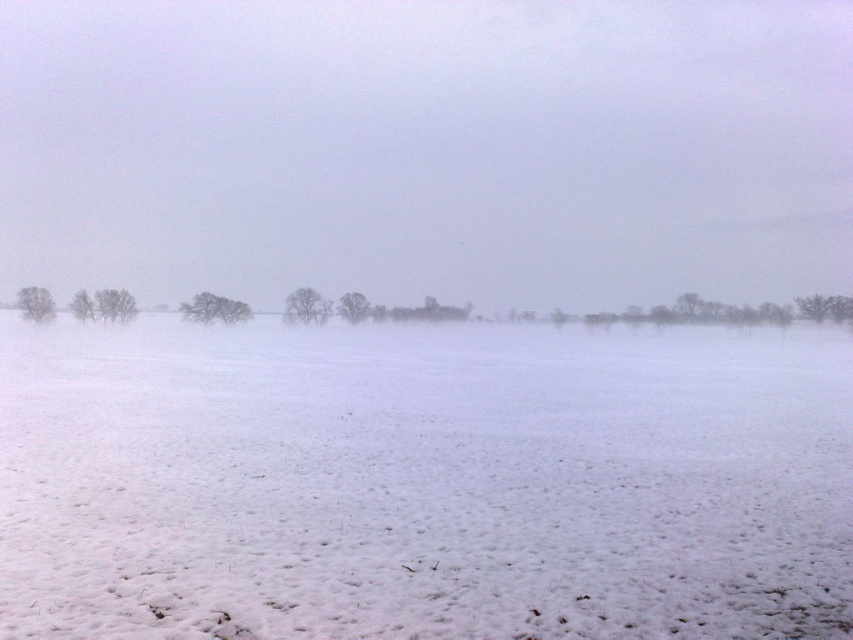
Identify the location of snowy bare branches at center. (213, 308).

Describe the element at coordinates (213, 308) in the screenshot. I see `snowy bare branches at center` at that location.

This screenshot has height=640, width=853. Identify the location of snowy bare branches at center. (213, 308).

Where is `snowy bare tree at left`? snowy bare tree at left is located at coordinates (115, 305).

Who is more forward, (131,301) or (339,300)?

Point (131,301) is in front.

What do you see at coordinates (115, 305) in the screenshot? I see `snowy bare tree at left` at bounding box center [115, 305].

Find the location of a particular element. The width and height of the screenshot is (853, 640). snowy bare tree at left is located at coordinates (115, 305).

How distant is bare branches at center from bare branches at left?

The distance of bare branches at center from bare branches at left is 20.58 meters.

Which is in front, point (321, 298) or point (71, 301)?

Point (321, 298)

Who is more distant from viewer, (x=289, y=321) or (x=74, y=292)?

Point (x=74, y=292)

At what (x,y) coordinates should I click in order to perform the action: click on bare branches at center. Please return your answer as a coordinate pair (x, y). The height and width of the screenshot is (640, 853). Looking at the image, I should click on click(306, 307).